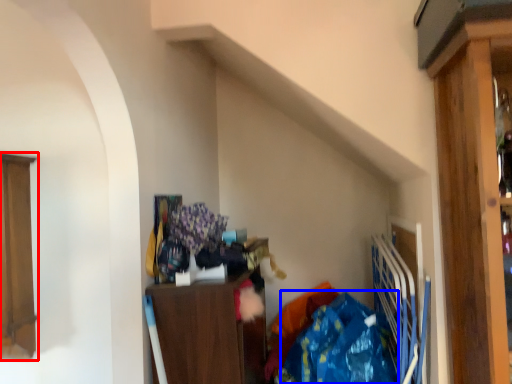
Question: Which point is further to the camera, cabinetry (highlighted by a red box) or clothing (highlighted by a blue box)?

Choices:
 (A) cabinetry
 (B) clothing

Answer: (A)